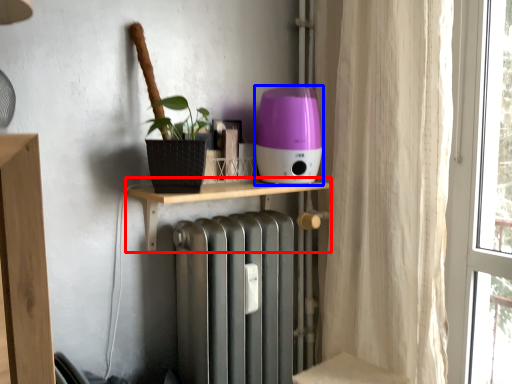
Question: Which point is closer to the camera, shelf (highlighted by a red box) or appliance (highlighted by a blue box)?

Choices:
 (A) shelf
 (B) appliance

Answer: (A)